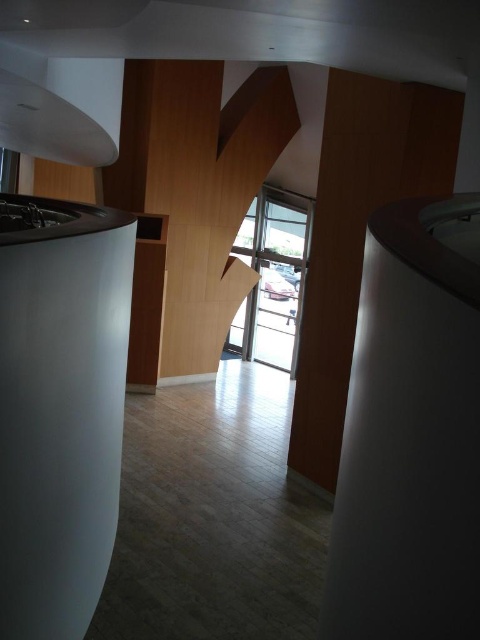
Between white matte pillar at left and transparent glass door at center, which one appears on the left side from the viewer's perspective?

white matte pillar at left is more to the left.

Does white matte pillar at left lie in front of transparent glass door at center?

Yes.

Is point (63, 564) in front of point (278, 236)?

Yes, point (63, 564) is closer to viewer.

Identify the location of white matte pillar at left. (60, 406).